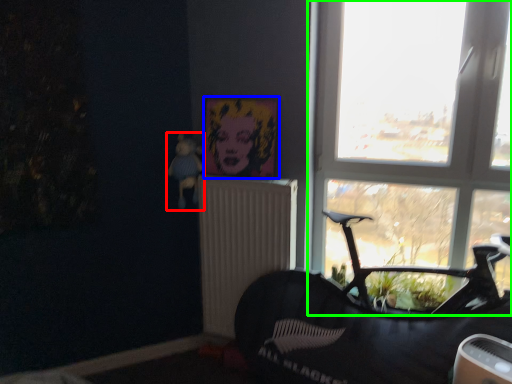
Question: Which is farther away from toy (highlighted by a red box)? picture frame (highlighted by a blue box) or window (highlighted by a green box)?

Choices:
 (A) picture frame
 (B) window

Answer: (B)